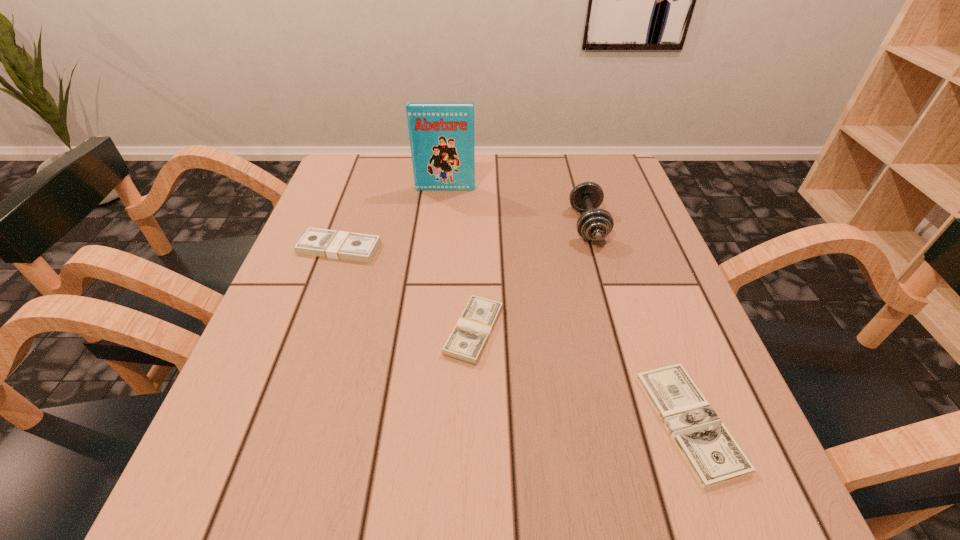
Where is `object at the far right corner`? The height and width of the screenshot is (540, 960). object at the far right corner is located at coordinates (594, 224).

Locate an element on the screen. This screenshot has height=540, width=960. object that is at the near right corner is located at coordinates (713, 455).

Where is `blank space at the far edge`? This screenshot has width=960, height=540. blank space at the far edge is located at coordinates (532, 156).

Find the location of a particular element. vacant region at the near edge of the desktop is located at coordinates (504, 463).

Where is `free space at the left edge`? The height and width of the screenshot is (540, 960). free space at the left edge is located at coordinates (271, 318).

This screenshot has width=960, height=540. In order to click on vacant space at the right edge of the desktop in this screenshot , I will do `click(659, 284)`.

Where is `free space at the near left corner of the desktop`? The width and height of the screenshot is (960, 540). free space at the near left corner of the desktop is located at coordinates (285, 475).

Identify the location of vacant area at the far right corner. The image size is (960, 540). (608, 156).

Where is `empty space that is in between the tallest object and the dumbbell`? empty space that is in between the tallest object and the dumbbell is located at coordinates [516, 207].

Locate an element on the screen. empty location between the dumbbell and the nearest object is located at coordinates (638, 323).